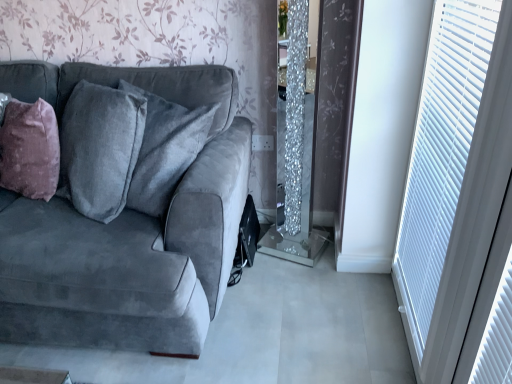
Question: Could you tell me if velvet gray couch at left is facing mauve velvet throw pillow at left?

Choices:
 (A) yes
 (B) no

Answer: (B)

Question: Considering the relative sizes of velvet gray couch at left and mauve velvet throw pillow at left in the image provided, is velvet gray couch at left wider than mauve velvet throw pillow at left?

Choices:
 (A) yes
 (B) no

Answer: (A)

Question: Is velvet gray couch at left touching mauve velvet throw pillow at left?

Choices:
 (A) yes
 (B) no

Answer: (B)

Question: From the image's perspective, is velvet gray couch at left on top of mauve velvet throw pillow at left?

Choices:
 (A) no
 (B) yes

Answer: (A)

Question: Does velvet gray couch at left lie behind mauve velvet throw pillow at left?

Choices:
 (A) yes
 (B) no

Answer: (B)

Question: From the image's perspective, relative to white plastic blinds at right, is velvet gray couch at left above or below?

Choices:
 (A) below
 (B) above

Answer: (A)

Question: Is velvet gray couch at left wider or thinner than white plastic blinds at right?

Choices:
 (A) thin
 (B) wide

Answer: (B)

Question: Is velvet gray couch at left inside or outside of white plastic blinds at right?

Choices:
 (A) outside
 (B) inside

Answer: (A)

Question: Is velvet gray couch at left taller or shorter than white plastic blinds at right?

Choices:
 (A) tall
 (B) short

Answer: (B)

Question: Considering the positions of point (129, 256) and point (44, 198), is point (129, 256) closer or farther from the camera than point (44, 198)?

Choices:
 (A) closer
 (B) farther

Answer: (A)

Question: Looking at the image, does velvet gray couch at left seem bigger or smaller compared to mauve velvet throw pillow at left?

Choices:
 (A) small
 (B) big

Answer: (B)

Question: Do you think velvet gray couch at left is within mauve velvet throw pillow at left, or outside of it?

Choices:
 (A) outside
 (B) inside

Answer: (A)

Question: Considering the positions of velvet gray couch at left and mauve velvet throw pillow at left in the image, is velvet gray couch at left taller or shorter than mauve velvet throw pillow at left?

Choices:
 (A) tall
 (B) short

Answer: (A)

Question: Considering the positions of mauve velvet throw pillow at left and white plastic blinds at right in the image, is mauve velvet throw pillow at left bigger or smaller than white plastic blinds at right?

Choices:
 (A) small
 (B) big

Answer: (B)

Question: Considering their positions, is mauve velvet throw pillow at left located in front of or behind white plastic blinds at right?

Choices:
 (A) behind
 (B) front

Answer: (A)